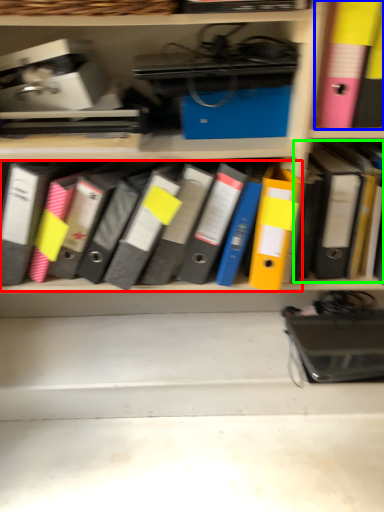
Question: Considering the real-world distances, which object is closest to notebook (highlighted by a red box)? bin (highlighted by a blue box) or book (highlighted by a green box).

Choices:
 (A) bin
 (B) book

Answer: (B)